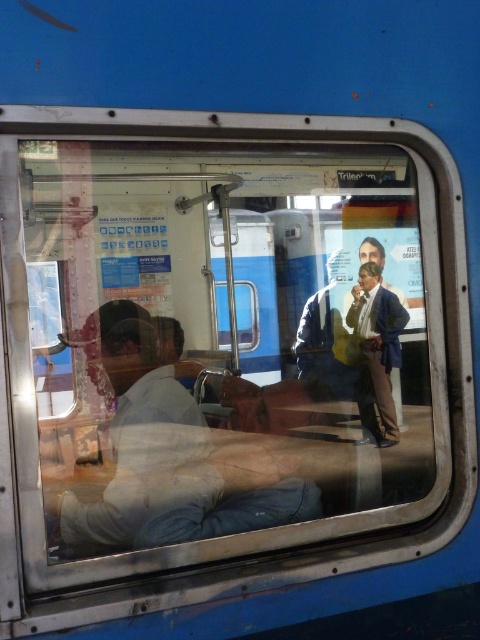
You are a passenger on a train and want to sit next to the person in the matte blue suit at center. Which direction should you move to reach them from the light beige shirt at lower left?

The light beige shirt at lower left is positioned on the left side of matte blue suit at center, so you should move to the right to reach the matte blue suit at center.

You are a passenger standing near the window in the train carriage. You notice two people in the scene. The first is wearing a light beige shirt at lower left, and the second is wearing a matte blue suit at center. Based on their positions and the available space, can you determine which person is closer to the window?

The light beige shirt at lower left is much taller than the matte blue suit at center, which indicates that the person in the light beige shirt at lower left is closer to the window.